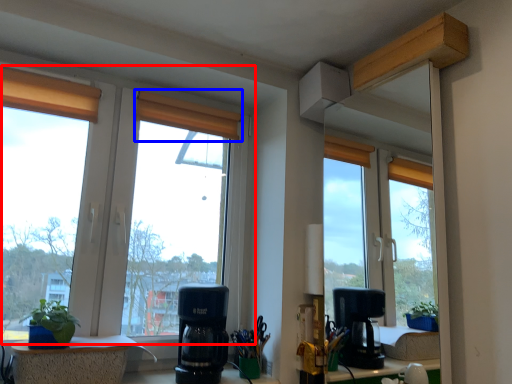
Question: Which point is closer to the camera, window (highlighted by a red box) or curtain (highlighted by a blue box)?

Choices:
 (A) window
 (B) curtain

Answer: (A)